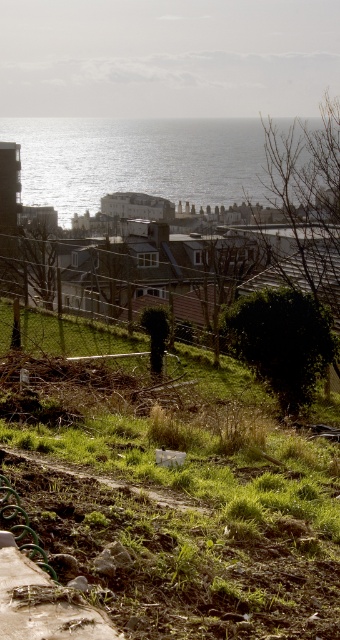
Which of these two, brown wire fence at center or green grassy path at lower center, stands shorter?

Standing shorter between the two is green grassy path at lower center.

Between brown wire fence at center and green grassy path at lower center, which one appears on the left side from the viewer's perspective?

Positioned to the left is green grassy path at lower center.

Who is more distant from viewer, [285,227] or [180,512]?

The point [285,227] is behind.

In order to click on brown wire fence at center in this screenshot , I will do `click(192, 272)`.

Between point (262, 140) and point (116, 483), which one is positioned in front?

Point (116, 483) is more forward.

Which is more to the right, glistening silver water at upper center or green grassy path at lower center?

Positioned to the right is glistening silver water at upper center.

Is point (183, 134) positioned in front of point (126, 484)?

No, (183, 134) is behind (126, 484).

At what (x,y) coordinates should I click in order to perform the action: click on glistening silver water at upper center. Please return your answer as a coordinate pair (x, y). This screenshot has width=340, height=640. Looking at the image, I should click on (137, 161).

Is glistening silver water at upper center taller than brown wire fence at center?

Yes, glistening silver water at upper center is taller than brown wire fence at center.

Based on the photo, how much distance is there between glistening silver water at upper center and brown wire fence at center?

glistening silver water at upper center is 79.13 meters from brown wire fence at center.

Between point (253, 180) and point (208, 294), which one is positioned in front?

Point (208, 294)

Find the location of a particular element. glistening silver water at upper center is located at coordinates (137, 161).